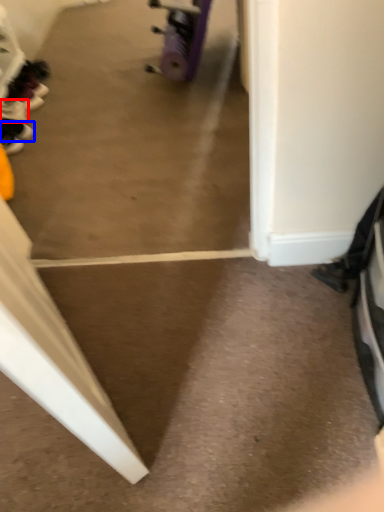
Question: Which of the following is the farthest to the observer, footwear (highlighted by a red box) or footwear (highlighted by a blue box)?

Choices:
 (A) footwear
 (B) footwear

Answer: (A)